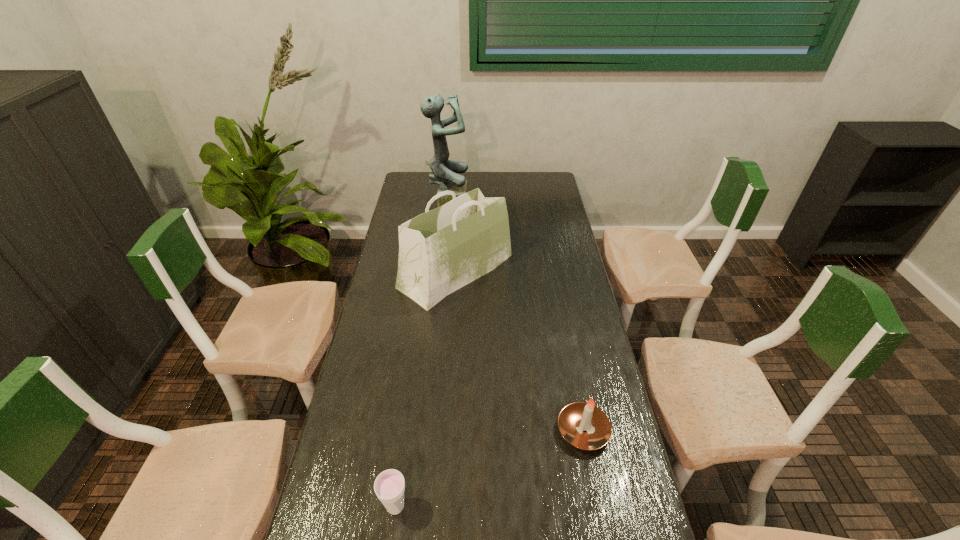
Find the location of a particular element. vacant space that satisfies the following two spatial constraints: 1. on the back side of the nearest object; 2. on the left side of the third farthest object is located at coordinates (406, 430).

Find the location of a particular element. This screenshot has height=540, width=960. free space that satisfies the following two spatial constraints: 1. on the face of the sculpture; 2. on the back side of the candle is located at coordinates (426, 430).

Locate an element on the screen. The width and height of the screenshot is (960, 540). vacant space that satisfies the following two spatial constraints: 1. on the back side of the grocery bag; 2. on the left side of the nearest object is located at coordinates (428, 271).